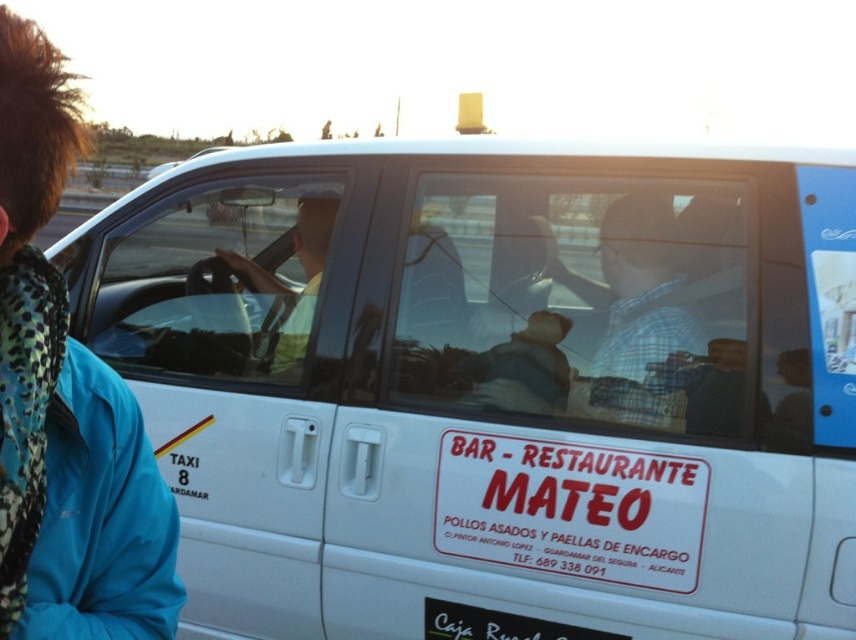
You are a customer looking for the restaurant. You see the blue fabric jacket at left and the white paper sign at center inside the taxi. Which object is covering the other one?

The blue fabric jacket at left is positioned over the white paper sign at center, so it is covering the white paper sign at center.